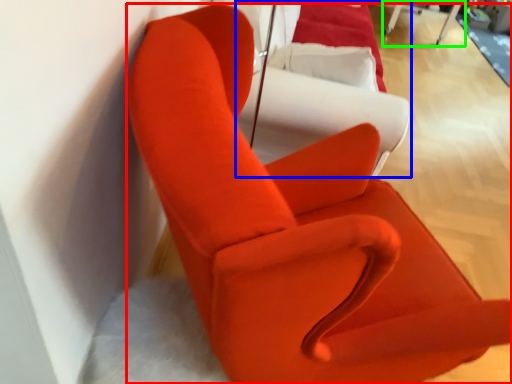
Question: Which is farther away from chair (highlighted by a red box)? couch (highlighted by a blue box) or table (highlighted by a green box)?

Choices:
 (A) couch
 (B) table

Answer: (B)